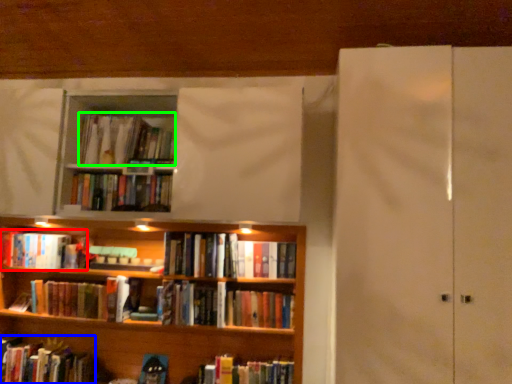
Question: Which object is positioned farthest from book (highlighted by a red box)? Select from book (highlighted by a blue box) and book (highlighted by a green box).

Choices:
 (A) book
 (B) book

Answer: (B)